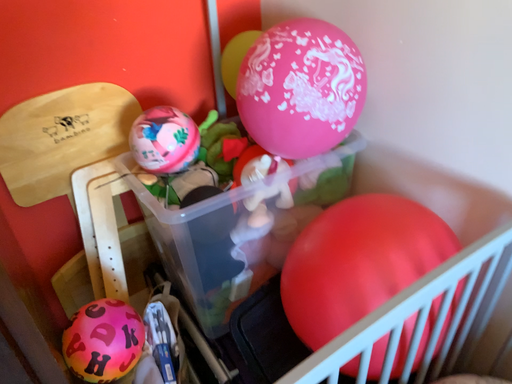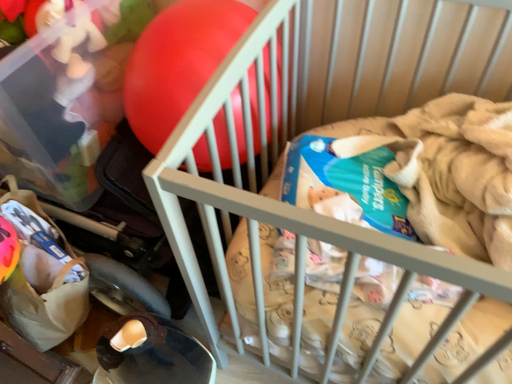
Question: How did the camera likely rotate when shooting the video?

Choices:
 (A) rotated right
 (B) rotated left

Answer: (A)